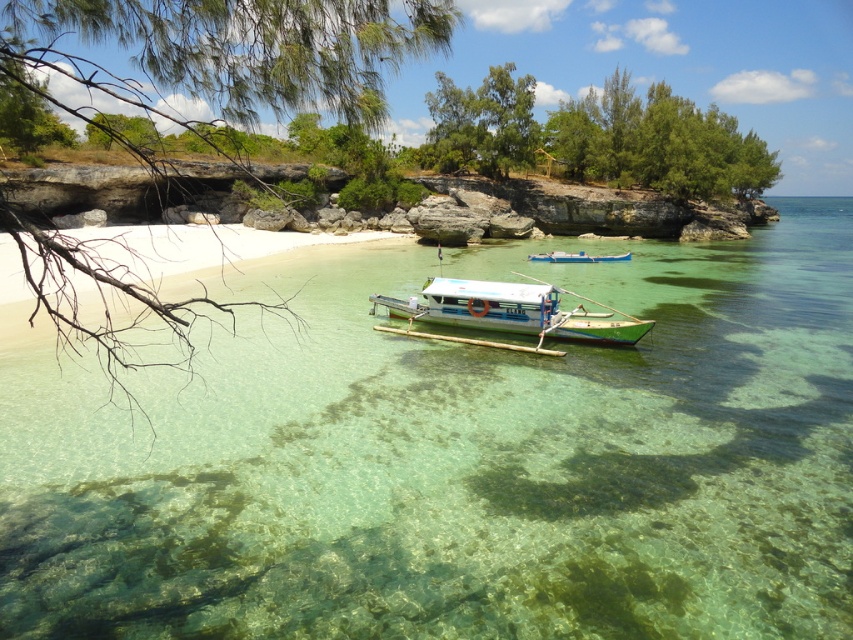
Question: Which is nearer to the clear glassy water at center?

Choices:
 (A) white plastic boat at center
 (B) white matte boat at center

Answer: (B)

Question: Is white matte boat at center smaller than white plastic boat at center?

Choices:
 (A) no
 (B) yes

Answer: (A)

Question: Which object is closer to the camera taking this photo?

Choices:
 (A) clear glassy water at center
 (B) white plastic boat at center

Answer: (A)

Question: Observing the image, what is the correct spatial positioning of white matte boat at center in reference to white plastic boat at center?

Choices:
 (A) below
 (B) above

Answer: (A)

Question: Estimate the real-world distances between objects in this image. Which object is farther from the white plastic boat at center?

Choices:
 (A) white matte boat at center
 (B) clear glassy water at center

Answer: (A)

Question: Can you confirm if clear glassy water at center is wider than white matte boat at center?

Choices:
 (A) yes
 (B) no

Answer: (A)